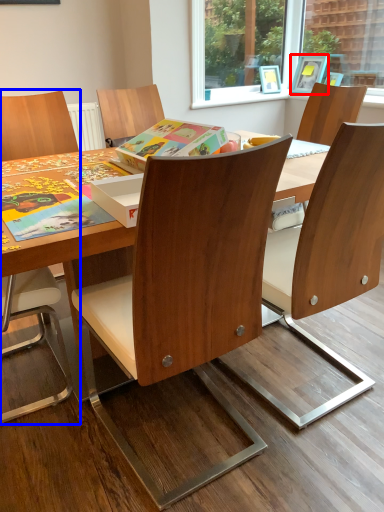
Question: Which object appears closest to the camera in this image, picture frame (highlighted by a red box) or chair (highlighted by a blue box)?

Choices:
 (A) picture frame
 (B) chair

Answer: (B)